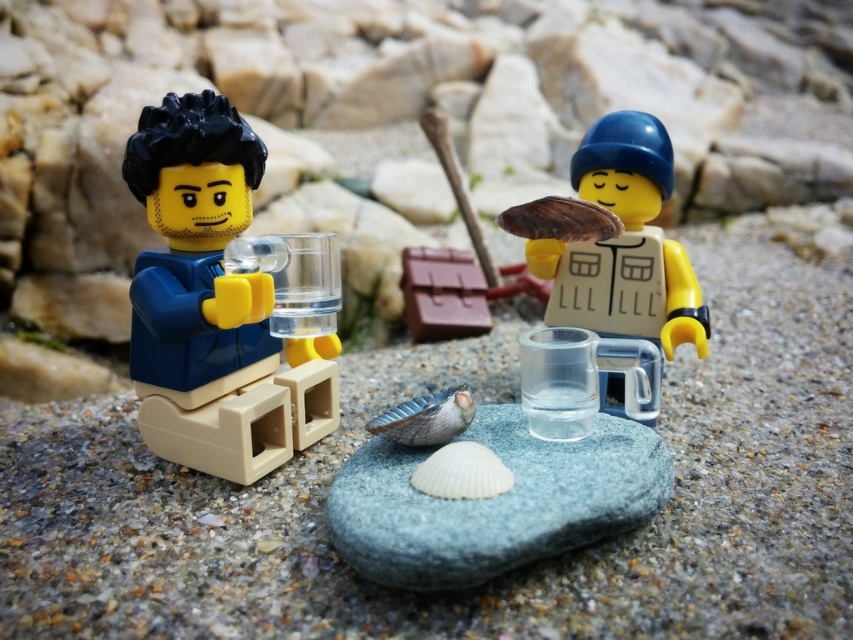
Question: Does matte blue shirt at left have a smaller size compared to smooth gray rock at center?

Choices:
 (A) yes
 (B) no

Answer: (B)

Question: Which of these objects is positioned closest to the translucent plastic mug at center?

Choices:
 (A) smooth gray rock at center
 (B) matte blue shirt at left

Answer: (A)

Question: Estimate the real-world distances between objects in this image. Which object is farther from the matte blue shirt at left?

Choices:
 (A) translucent plastic mug at center
 (B) smooth gray rock at center

Answer: (A)

Question: Estimate the real-world distances between objects in this image. Which object is closer to the smooth gray rock at center?

Choices:
 (A) matte blue shirt at left
 (B) translucent plastic mug at center

Answer: (A)

Question: Where is smooth gray rock at center located in relation to translucent plastic mug at center in the image?

Choices:
 (A) left
 (B) right

Answer: (A)

Question: Is matte blue shirt at left bigger than translucent plastic mug at center?

Choices:
 (A) yes
 (B) no

Answer: (A)